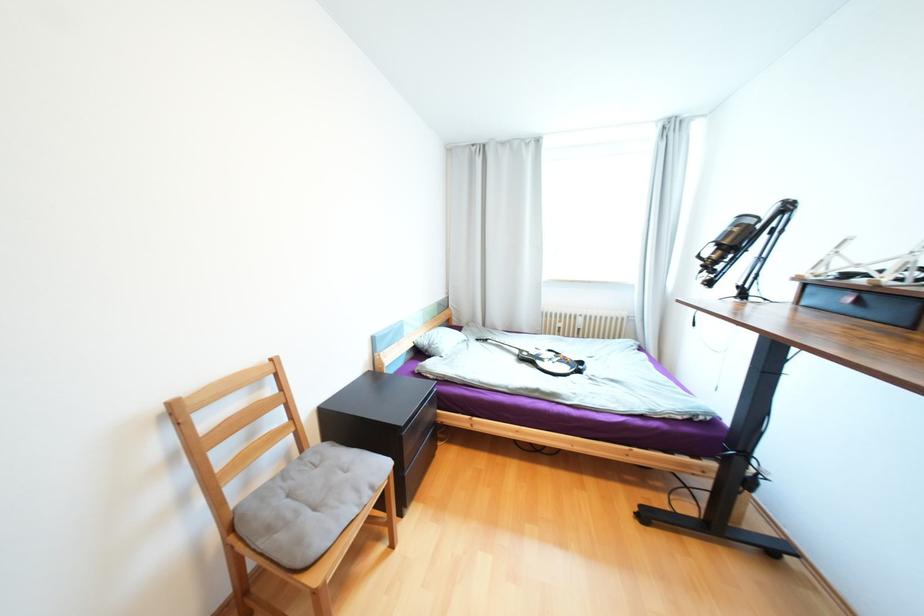
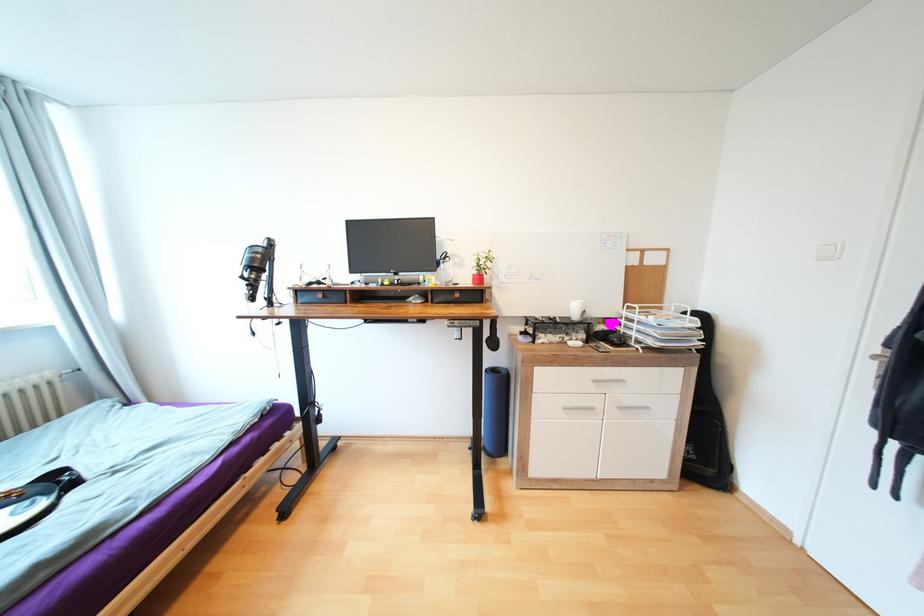
Question: The camera is either moving clockwise (left) or counter-clockwise (right) around the object. The first image is from the beginning of the video and the second image is from the end. Is the camera moving left or right when shooting the video?

Choices:
 (A) Left
 (B) Right

Answer: (A)